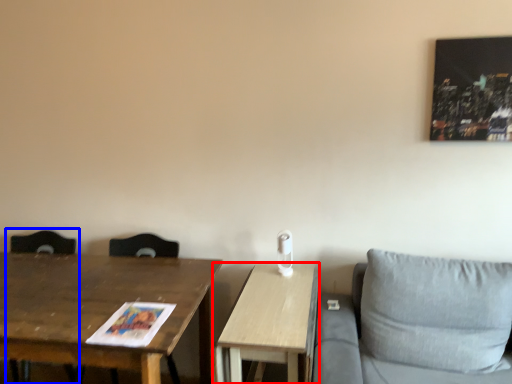
Question: Which of the following is the farthest to the observer, table (highlighted by a red box) or swivel chair (highlighted by a blue box)?

Choices:
 (A) table
 (B) swivel chair

Answer: (B)